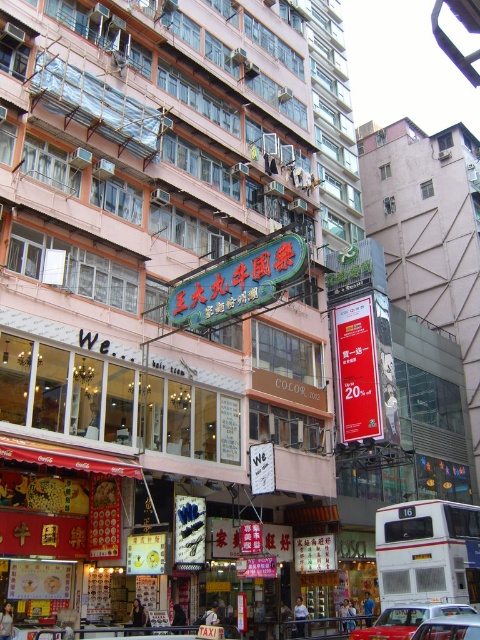
You are a photographer standing on the sidewalk of this Hong Kong street scene. You want to capture a photo that includes both the white metallic bus at lower right and the red paper sign at center. Considering their sizes, which object should you frame closer to avoid cropping either of them?

Since the white metallic bus at lower right is larger than the red paper sign at center, you should frame the white metallic bus at lower right closer to avoid cropping either object.

You are standing on the street looking at the building with pinkish facade. There are two points marked on the building. One is at coordinate point (336,381) and the other is at point (430,632). Which point is closer to you?

Point (430,632) is closer to you because it is less further to the camera than point (336,381).

You are standing on the street looking at the building with the pinkish facade. There are two points marked on the building wall. The first point is at coordinates point (x=386, y=608) and the second is at point (x=441, y=628). Which point is closer to you?

Point (x=386, y=608) is closer to you because it is further to the viewer than point (x=441, y=628).